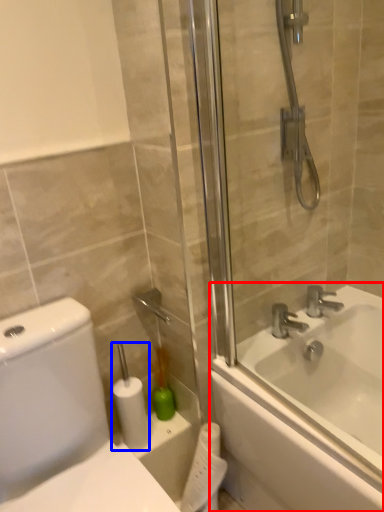
Question: Which object is further to the camera taking this photo, bathtub (highlighted by a red box) or toilet paper (highlighted by a blue box)?

Choices:
 (A) bathtub
 (B) toilet paper

Answer: (B)